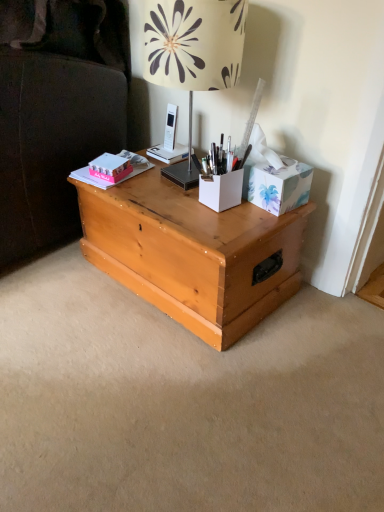
You are a GUI agent. You are given a task and a screenshot of the screen. Output one action in this format:
    pyautogui.click(x=<x>, y=<y>)
    Task: Click on the free space above light wood trunk at center (from a real-world perspective)
    
    Given the screenshot: What is the action you would take?
    pyautogui.click(x=181, y=196)